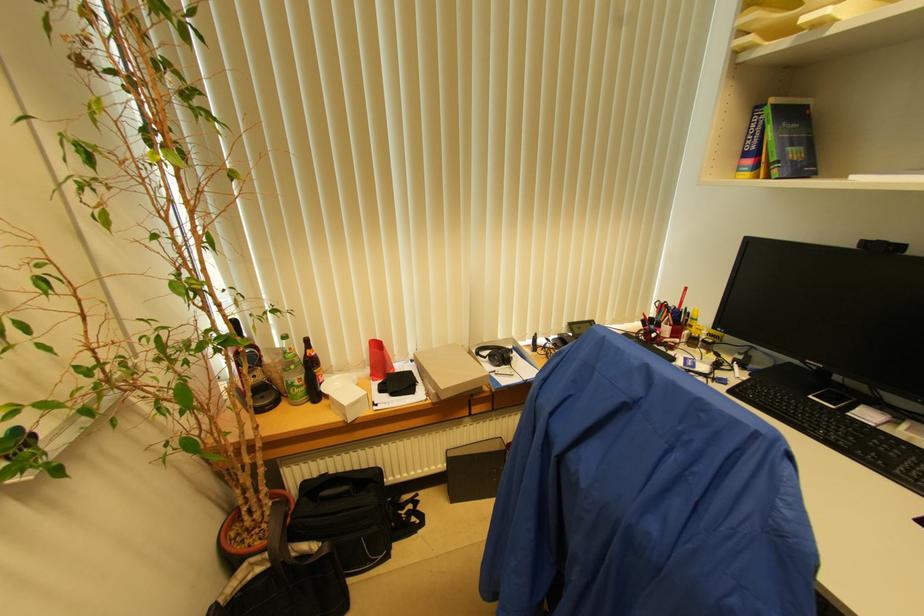
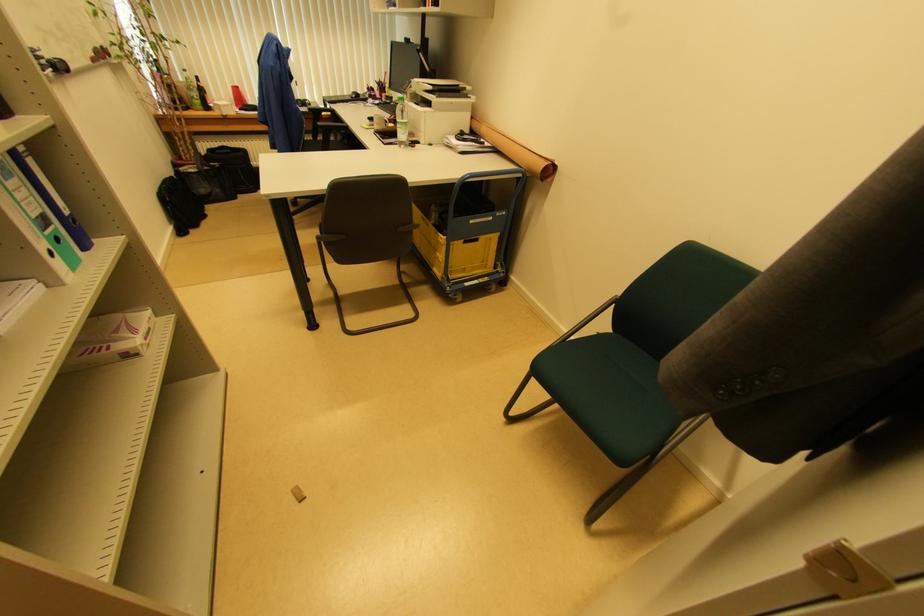
Find the pixel in the second image that matches (304,379) in the first image.

(200, 98)